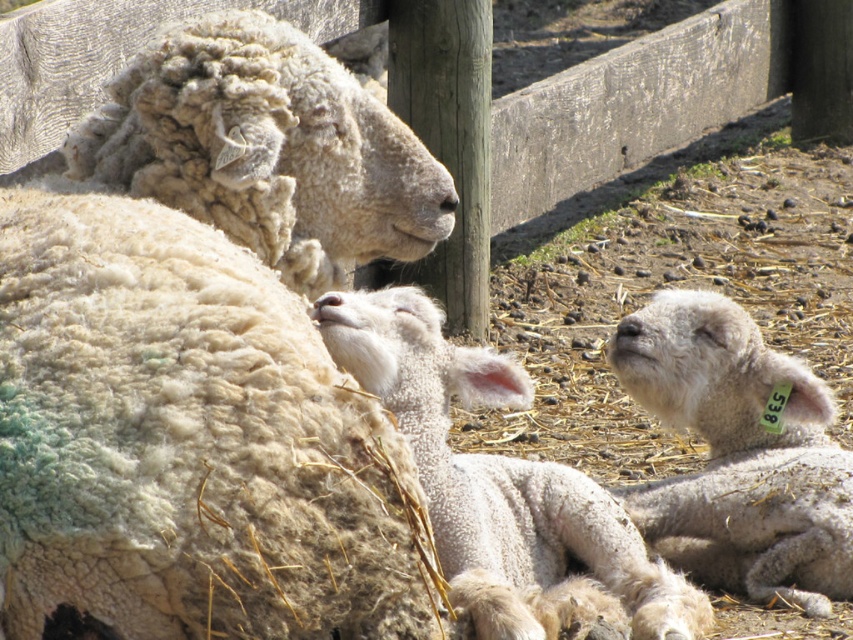
Does white fluffy lamb at center have a greater width compared to white fluffy lamb at right?

Correct, the width of white fluffy lamb at center exceeds that of white fluffy lamb at right.

This screenshot has width=853, height=640. What do you see at coordinates (503, 490) in the screenshot? I see `white fluffy lamb at center` at bounding box center [503, 490].

Which is behind, point (556, 588) or point (784, 588)?

The point (784, 588) is behind.

Where is `white fluffy lamb at center`? white fluffy lamb at center is located at coordinates (503, 490).

Is white woolen sheep at upper left positioned in front of white fluffy lamb at right?

Yes, it is in front of white fluffy lamb at right.

Between point (347, 429) and point (798, 449), which one is positioned behind?

Positioned behind is point (798, 449).

Identify the location of white woolen sheep at upper left. The image size is (853, 640). (184, 442).

This screenshot has width=853, height=640. In order to click on white woolen sheep at upper left in this screenshot , I will do `click(184, 442)`.

Measure the distance between white woolen sheep at upper left and white fluffy lamb at center.

A distance of 49.83 centimeters exists between white woolen sheep at upper left and white fluffy lamb at center.

Is white woolen sheep at upper left above white fluffy lamb at center?

Correct, white woolen sheep at upper left is located above white fluffy lamb at center.

Which is in front, point (199, 346) or point (579, 627)?

Point (199, 346) is in front.

At what (x,y) coordinates should I click in order to perform the action: click on white woolen sheep at upper left. Please return your answer as a coordinate pair (x, y). Looking at the image, I should click on (184, 442).